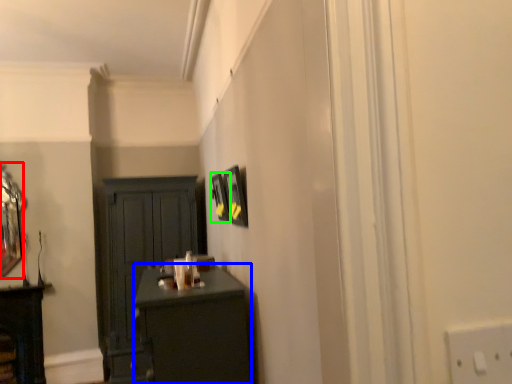
Question: Which object is positioned closest to mirror (highlighted by a red box)? Select from desk (highlighted by a blue box) and picture frame (highlighted by a green box).

Choices:
 (A) desk
 (B) picture frame

Answer: (B)